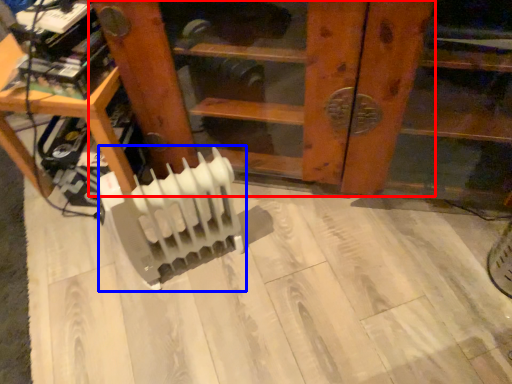
Question: Which point is further to the camera, furniture (highlighted by a red box) or radiator (highlighted by a blue box)?

Choices:
 (A) furniture
 (B) radiator

Answer: (B)